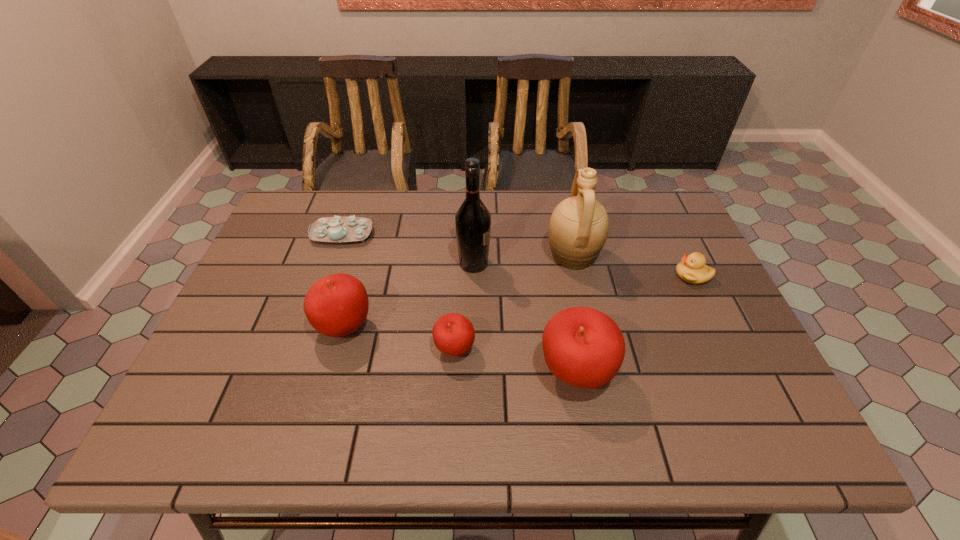
You are a GUI agent. You are given a task and a screenshot of the screen. Output one action in this format:
    pyautogui.click(x=<x>, y=<y>)
    Task: Click on the leftmost apple
    
    Given the screenshot: What is the action you would take?
    pyautogui.click(x=336, y=305)

Image resolution: width=960 pixels, height=540 pixels. I want to click on the fourth shortest object, so click(x=336, y=305).

Locate an element on the screen. This screenshot has width=960, height=540. the shortest apple is located at coordinates (453, 334).

Image resolution: width=960 pixels, height=540 pixels. What are the coordinates of `the fifth tallest object` in the screenshot? It's located at (453, 334).

You are a GUI agent. You are given a task and a screenshot of the screen. Output one action in this format:
    pyautogui.click(x=<x>, y=<y>)
    Task: Click on the rightmost apple
    This screenshot has width=960, height=540.
    Given the screenshot: What is the action you would take?
    pyautogui.click(x=583, y=347)

Locate an element on the screen. wine bottle is located at coordinates (472, 220).

You are a GUI agent. You are given a task and a screenshot of the screen. Output one action in this format:
    pyautogui.click(x=<x>, y=<y>)
    Task: Click on the pitcher
    This screenshot has width=960, height=540.
    Given the screenshot: What is the action you would take?
    pyautogui.click(x=578, y=228)

Identify the location of chinaware. (331, 229).

You are a GUI agent. You are given a task and a screenshot of the screen. Output one action in this format:
    pyautogui.click(x=<x>, y=<y>)
    Task: Click on the rightmost object
    This screenshot has width=960, height=540.
    Given the screenshot: What is the action you would take?
    pyautogui.click(x=692, y=269)

The height and width of the screenshot is (540, 960). In order to click on free point located 0.240m on the right of the fourth tallest object in this screenshot , I will do `click(472, 327)`.